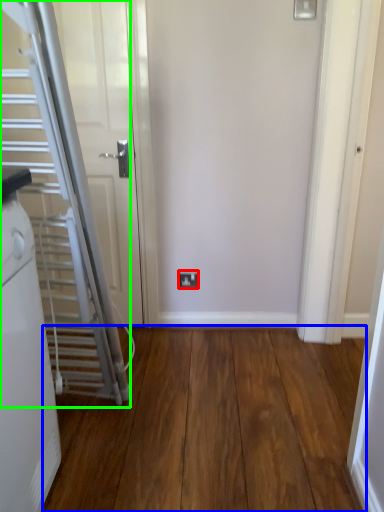
Question: Considering the real-world distances, which object is closest to electric outlet (highlighted by a red box)? corridor (highlighted by a blue box) or escalator (highlighted by a green box).

Choices:
 (A) corridor
 (B) escalator

Answer: (A)